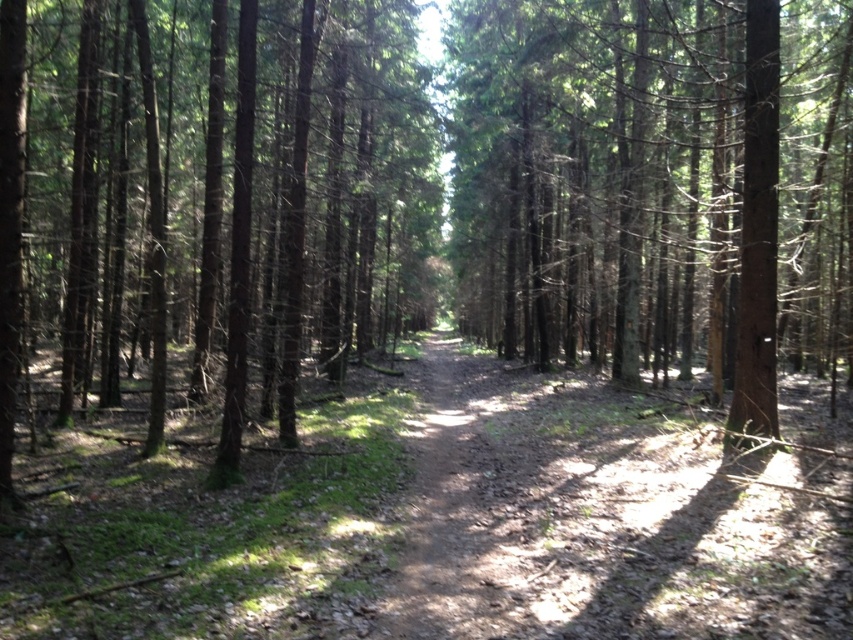
Question: Which of the following is the closest to the observer?

Choices:
 (A) brown/dry wood at center
 (B) brown wood tree at center

Answer: (B)

Question: Does brown/dry wood at center lie in front of brown wood tree at center?

Choices:
 (A) no
 (B) yes

Answer: (A)

Question: Which object is closer to the camera taking this photo?

Choices:
 (A) brown wood tree at center
 (B) brown dirt track at center
 (C) brown/dry wood at center

Answer: (B)

Question: Is brown/dry wood at center to the right of brown dirt track at center from the viewer's perspective?

Choices:
 (A) no
 (B) yes

Answer: (B)

Question: Considering the real-world distances, which object is closest to the brown/dry wood at center?

Choices:
 (A) brown wood tree at center
 (B) brown dirt track at center

Answer: (B)

Question: Is brown dirt track at center wider than brown wood tree at center?

Choices:
 (A) yes
 (B) no

Answer: (B)